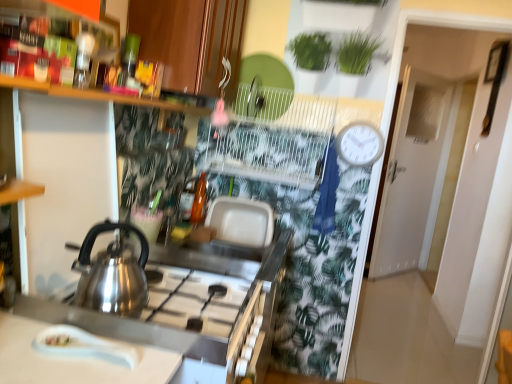
Question: Is wooden cabinet at upper center not close to translucent glass bottle at center, the 1th bottle in the front-to-back sequence?

Choices:
 (A) no
 (B) yes

Answer: (A)

Question: Does wooden cabinet at upper center have a greater width compared to translucent glass bottle at center, marked as the second bottle in a back-to-front arrangement?

Choices:
 (A) no
 (B) yes

Answer: (B)

Question: Is wooden cabinet at upper center oriented away from translucent glass bottle at center, marked as the second bottle in a back-to-front arrangement?

Choices:
 (A) no
 (B) yes

Answer: (A)

Question: From the image's perspective, does wooden cabinet at upper center appear higher than translucent glass bottle at center, marked as the second bottle in a back-to-front arrangement?

Choices:
 (A) yes
 (B) no

Answer: (A)

Question: Does wooden cabinet at upper center have a smaller size compared to translucent glass bottle at center, the 1th bottle in the front-to-back sequence?

Choices:
 (A) yes
 (B) no

Answer: (B)

Question: Is wooden cabinet at upper center placed right next to translucent glass bottle at center, marked as the second bottle in a back-to-front arrangement?

Choices:
 (A) yes
 (B) no

Answer: (B)

Question: Can you confirm if translucent glass bottle at center, the first bottle positioned from the back, is positioned to the right of wooden cabinet at upper center?

Choices:
 (A) yes
 (B) no

Answer: (B)

Question: From a real-world perspective, is translucent glass bottle at center, the second bottle in the front-to-back sequence, on top of wooden cabinet at upper center?

Choices:
 (A) yes
 (B) no

Answer: (B)

Question: Is translucent glass bottle at center, the first bottle positioned from the back, turned away from wooden cabinet at upper center?

Choices:
 (A) no
 (B) yes

Answer: (A)

Question: From the image's perspective, is translucent glass bottle at center, the second bottle in the front-to-back sequence, above wooden cabinet at upper center?

Choices:
 (A) no
 (B) yes

Answer: (A)

Question: Can you confirm if translucent glass bottle at center, the second bottle in the front-to-back sequence, is smaller than wooden cabinet at upper center?

Choices:
 (A) yes
 (B) no

Answer: (A)

Question: Is wooden cabinet at upper center located within translucent glass bottle at center, the second bottle in the front-to-back sequence?

Choices:
 (A) no
 (B) yes

Answer: (A)

Question: Is stainless steel counter at lower left at the left side of white plastic clock at upper right?

Choices:
 (A) yes
 (B) no

Answer: (A)